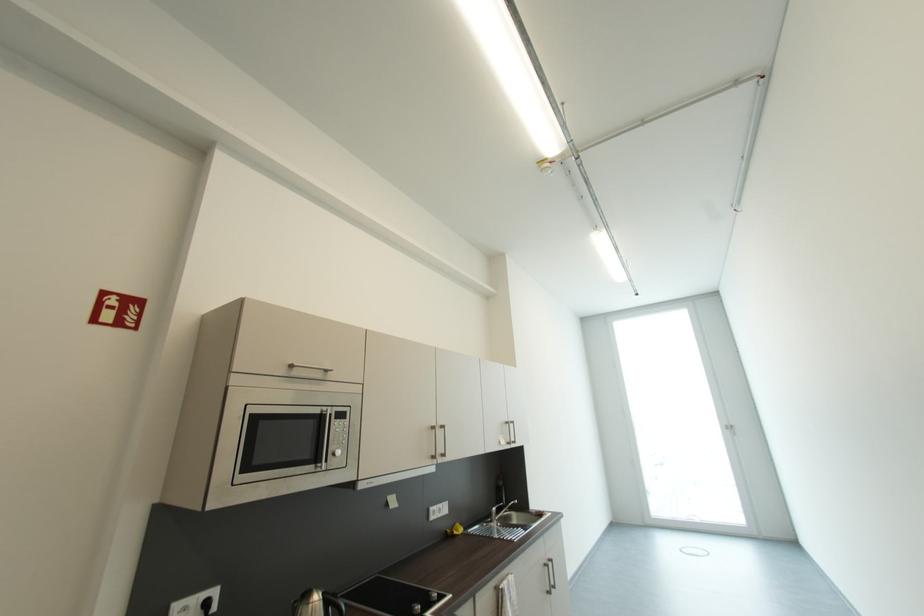
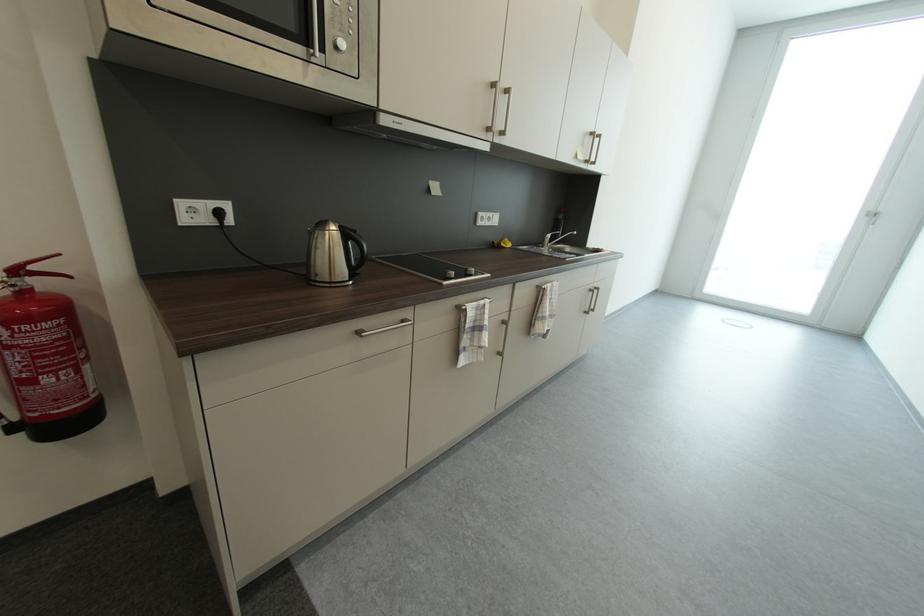
The point at (552, 567) is marked in the first image. Where is the corresponding point in the second image?

(598, 292)